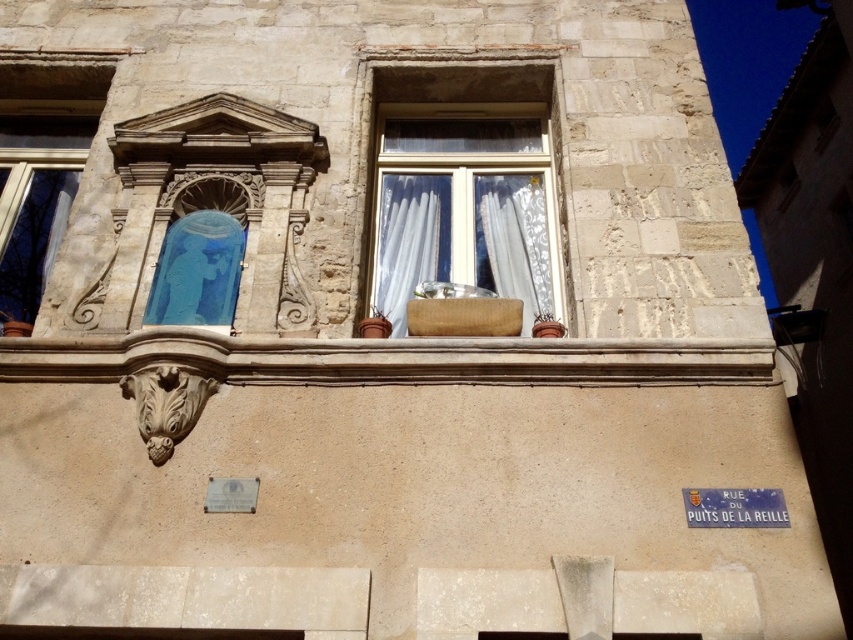
Is blue glass window at center further to camera compared to white sheer curtain at center?

No, blue glass window at center is in front of white sheer curtain at center.

Is point (202, 212) in front of point (374, 282)?

Yes, it is.

At what (x,y) coordinates should I click in order to perform the action: click on blue glass window at center. Please return your answer as a coordinate pair (x, y). The image size is (853, 640). Looking at the image, I should click on (200, 256).

This screenshot has width=853, height=640. In order to click on white sheer curtains at center in this screenshot , I will do `click(463, 186)`.

Where is `white sheer curtains at center`? white sheer curtains at center is located at coordinates (463, 186).

Between blue glass window at center and white lace curtain at upper center, which one is positioned lower?

Positioned lower is blue glass window at center.

Who is taller, blue glass window at center or white lace curtain at upper center?

Standing taller between the two is white lace curtain at upper center.

Is point (221, 241) closer to camera compared to point (505, 262)?

Yes, it is in front of point (505, 262).

The height and width of the screenshot is (640, 853). Find the location of `blue glass window at center`. blue glass window at center is located at coordinates (200, 256).